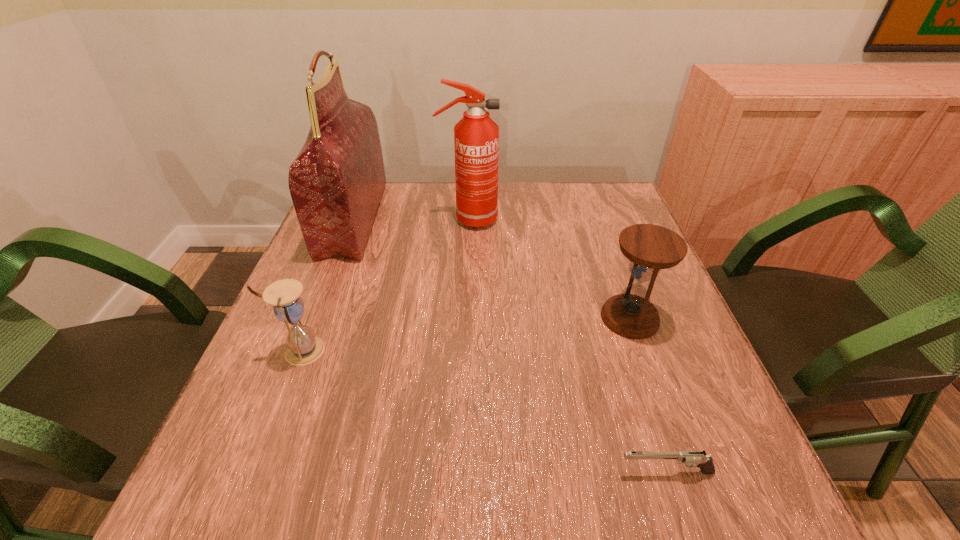
The image size is (960, 540). I want to click on vacant point located between the handbag and the nearest object, so click(510, 346).

Identify the location of empty space between the handbag and the left hourglass. The width and height of the screenshot is (960, 540). (327, 285).

Find the location of `free point between the left hourglass and the right hourglass`. free point between the left hourglass and the right hourglass is located at coordinates (466, 334).

The height and width of the screenshot is (540, 960). I want to click on free space between the third object from left to right and the nearest object, so click(x=567, y=346).

This screenshot has width=960, height=540. I want to click on free area in between the left hourglass and the shortest object, so click(484, 411).

Where is `free spot between the right hourglass and the shortest object`? The height and width of the screenshot is (540, 960). free spot between the right hourglass and the shortest object is located at coordinates (648, 395).

You are a GUI agent. You are given a task and a screenshot of the screen. Output one action in this format:
    pyautogui.click(x=<x>, y=<y>)
    Task: Click on the vacant area between the right hourglass and the fire extinguisher
    This screenshot has height=540, width=960.
    Given the screenshot: What is the action you would take?
    pyautogui.click(x=549, y=269)

What are the coordinates of `free space between the left hourglass and the third object from right to left` in the screenshot? It's located at (385, 285).

Find the location of a particular element. The width and height of the screenshot is (960, 540). free spot between the third object from left to right and the pistol is located at coordinates (567, 346).

At what (x,y) coordinates should I click in order to perform the action: click on free point between the pistol and the second tallest object. Please return your answer as a coordinate pair (x, y). The image size is (960, 540). Looking at the image, I should click on pyautogui.click(x=567, y=346).